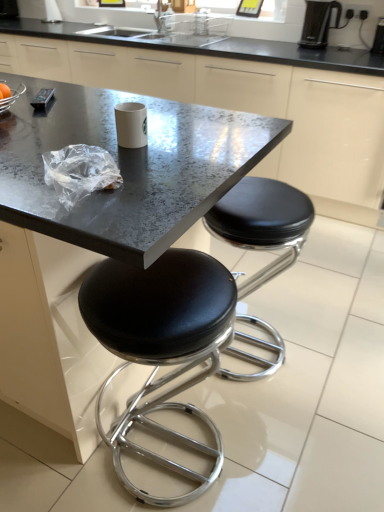
Question: Is metallic gray table at center positioned beyond the bounds of white glossy paper cup at center?

Choices:
 (A) yes
 (B) no

Answer: (A)

Question: Considering the relative positions of metallic gray table at center and white glossy paper cup at center in the image provided, is metallic gray table at center to the left of white glossy paper cup at center from the viewer's perspective?

Choices:
 (A) no
 (B) yes

Answer: (B)

Question: From the image's perspective, is metallic gray table at center located beneath white glossy paper cup at center?

Choices:
 (A) no
 (B) yes

Answer: (B)

Question: Would you say white glossy paper cup at center is part of metallic gray table at center's contents?

Choices:
 (A) yes
 (B) no

Answer: (B)

Question: Is metallic gray table at center turned away from white glossy paper cup at center?

Choices:
 (A) no
 (B) yes

Answer: (A)

Question: Is white glossy paper cup at center inside or outside of black plastic coffee maker at upper right?

Choices:
 (A) outside
 (B) inside

Answer: (A)

Question: Considering the positions of white glossy paper cup at center and black plastic coffee maker at upper right in the image, is white glossy paper cup at center wider or thinner than black plastic coffee maker at upper right?

Choices:
 (A) thin
 (B) wide

Answer: (B)

Question: From their relative heights in the image, would you say white glossy paper cup at center is taller or shorter than black plastic coffee maker at upper right?

Choices:
 (A) short
 (B) tall

Answer: (A)

Question: Does point [135, 121] appear closer or farther from the camera than point [372, 50]?

Choices:
 (A) farther
 (B) closer

Answer: (B)

Question: In the image, is black leather stool at center, acting as the 2th stool starting from the left, on the left side or the right side of metallic gray table at center?

Choices:
 (A) right
 (B) left

Answer: (A)

Question: Relative to metallic gray table at center, is black leather stool at center, which is counted as the 1th stool, starting from the right, in front or behind?

Choices:
 (A) behind
 (B) front

Answer: (A)

Question: From a real-world perspective, is black leather stool at center, acting as the 2th stool starting from the left, above or below metallic gray table at center?

Choices:
 (A) above
 (B) below

Answer: (B)

Question: Is black leather stool at center, acting as the 2th stool starting from the left, bigger or smaller than metallic gray table at center?

Choices:
 (A) big
 (B) small

Answer: (B)

Question: Considering the positions of black granite countertop at center and black leather stool at center, acting as the 2th stool starting from the left, in the image, is black granite countertop at center taller or shorter than black leather stool at center, acting as the 2th stool starting from the left,?

Choices:
 (A) tall
 (B) short

Answer: (A)

Question: In the image, is black granite countertop at center on the left side or the right side of black leather stool at center, which is counted as the 1th stool, starting from the right?

Choices:
 (A) right
 (B) left

Answer: (B)